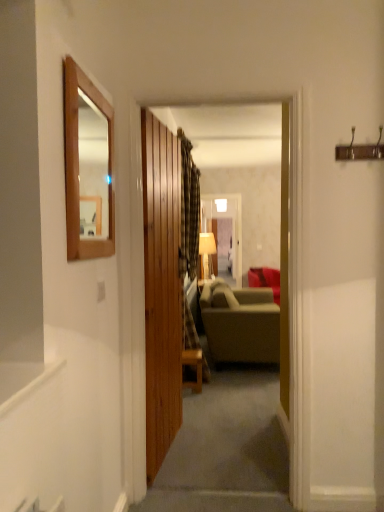
Question: Would you say wooden table at center is outside matte green fabric couch at center, placed as the second studio couch when sorted from front to back?

Choices:
 (A) yes
 (B) no

Answer: (A)

Question: Is wooden table at center positioned with its back to matte green fabric couch at center, placed as the second studio couch when sorted from front to back?

Choices:
 (A) no
 (B) yes

Answer: (A)

Question: Is wooden table at center at the left side of matte green fabric couch at center, which is counted as the 1th studio couch, starting from the back?

Choices:
 (A) no
 (B) yes

Answer: (B)

Question: Is matte green fabric couch at center, placed as the second studio couch when sorted from front to back, a part of wooden table at center?

Choices:
 (A) yes
 (B) no

Answer: (B)

Question: Is wooden table at center smaller than matte green fabric couch at center, which is counted as the 1th studio couch, starting from the back?

Choices:
 (A) no
 (B) yes

Answer: (B)

Question: From a real-world perspective, is wooden table at center located beneath matte green fabric couch at center, which is counted as the 1th studio couch, starting from the back?

Choices:
 (A) no
 (B) yes

Answer: (B)

Question: From a real-world perspective, does matte beige lampshade at center stand above wooden framed mirror at upper left?

Choices:
 (A) no
 (B) yes

Answer: (A)

Question: Would you consider matte beige lampshade at center to be distant from wooden framed mirror at upper left?

Choices:
 (A) no
 (B) yes

Answer: (B)

Question: Are matte beige lampshade at center and wooden framed mirror at upper left beside each other?

Choices:
 (A) yes
 (B) no

Answer: (B)

Question: Can you confirm if matte beige lampshade at center is positioned to the right of wooden framed mirror at upper left?

Choices:
 (A) yes
 (B) no

Answer: (A)

Question: Does matte beige lampshade at center have a lesser height compared to wooden framed mirror at upper left?

Choices:
 (A) no
 (B) yes

Answer: (A)

Question: From a real-world perspective, is matte beige lampshade at center beneath wooden framed mirror at upper left?

Choices:
 (A) yes
 (B) no

Answer: (A)

Question: Considering the relative sizes of wooden door at center and wooden framed mirror at upper left in the image provided, is wooden door at center shorter than wooden framed mirror at upper left?

Choices:
 (A) yes
 (B) no

Answer: (B)